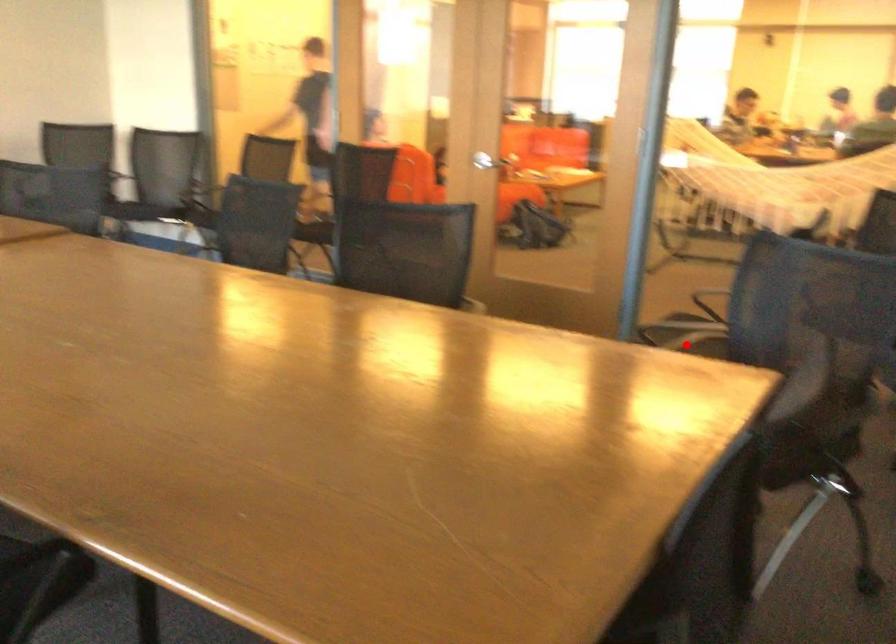
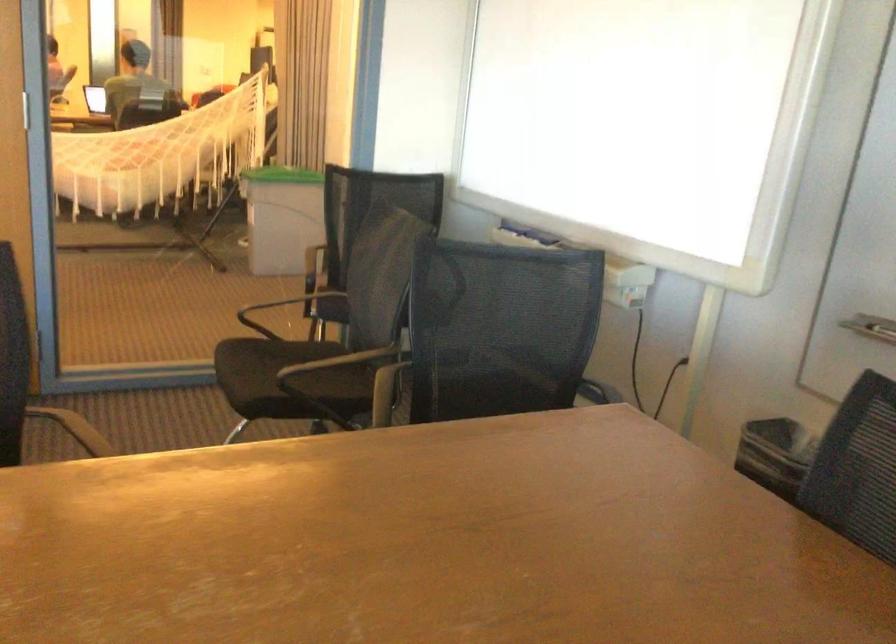
Question: I am providing you with two images of the same scene from different viewpoints. In image1, a red point is highlighted. Considering the same 3D point in image2, which of the following is correct?

Choices:
 (A) It is closer
 (B) It is farther

Answer: (A)